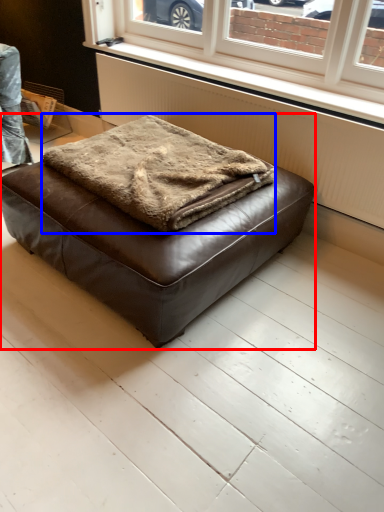
Question: Which object is closer to the camera taking this photo, furniture (highlighted by a red box) or blanket (highlighted by a blue box)?

Choices:
 (A) furniture
 (B) blanket

Answer: (A)